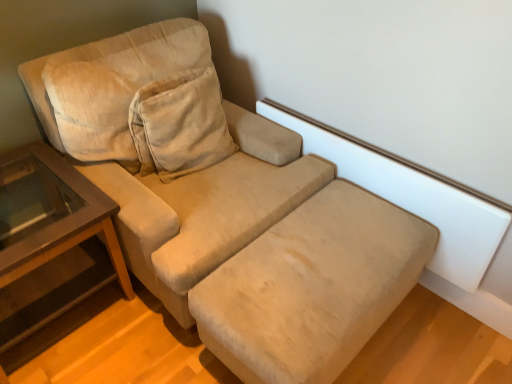
What do you see at coordinates (59, 222) in the screenshot? This screenshot has width=512, height=384. I see `brown wood table at left` at bounding box center [59, 222].

The image size is (512, 384). Find the location of `brown wood table at left`. brown wood table at left is located at coordinates (59, 222).

Measure the distance between point [76,238] and camera.

Point [76,238] and camera are 1.42 meters apart.

The height and width of the screenshot is (384, 512). Describe the element at coordinates (312, 287) in the screenshot. I see `beige fabric footrest at lower center` at that location.

Measure the distance between beige fabric footrest at lower center and camera.

They are 3.64 feet apart.

Where is `beige fabric footrest at lower center`? beige fabric footrest at lower center is located at coordinates (312, 287).

At what (x,y) coordinates should I click in order to perform the action: click on brown wood table at left. Please return your answer as a coordinate pair (x, y). This screenshot has height=384, width=512. Looking at the image, I should click on (59, 222).

Does beige fabric footrest at lower center appear on the left side of brown wood table at left?

Incorrect, beige fabric footrest at lower center is not on the left side of brown wood table at left.

Between beige fabric footrest at lower center and brown wood table at left, which one is positioned in front?

Positioned in front is beige fabric footrest at lower center.

Does point (412, 221) come farther from viewer compared to point (19, 275)?

Yes, it is.

From the image's perspective, which object appears higher, beige fabric footrest at lower center or brown wood table at left?

brown wood table at left is shown above in the image.

From a real-world perspective, is beige fabric footrest at lower center located higher than brown wood table at left?

No, from a real-world perspective, beige fabric footrest at lower center is not over brown wood table at left

Can you confirm if beige fabric footrest at lower center is wider than brown wood table at left?

No.

From their relative heights in the image, would you say beige fabric footrest at lower center is taller or shorter than brown wood table at left?

Considering their sizes, beige fabric footrest at lower center has less height than brown wood table at left.

Considering the sizes of beige fabric footrest at lower center and brown wood table at left in the image, is beige fabric footrest at lower center bigger or smaller than brown wood table at left?

beige fabric footrest at lower center is smaller than brown wood table at left.

Choose the correct answer: Is beige fabric footrest at lower center inside brown wood table at left or outside it?

beige fabric footrest at lower center is spatially situated outside brown wood table at left.

Is beige fabric footrest at lower center placed right next to brown wood table at left?

No, beige fabric footrest at lower center is not beside brown wood table at left.

Is beige fabric footrest at lower center oriented away from brown wood table at left?

Yes.

Can you tell me how much beige fabric footrest at lower center and brown wood table at left differ in facing direction?

The angular difference between beige fabric footrest at lower center and brown wood table at left is 1.96 degrees.

Find the location of a particular element. Image resolution: width=512 pixels, height=384 pixels. footrest on the right of brown wood table at left is located at coordinates (312, 287).

Is brown wood table at left at the left side of beige fabric footrest at lower center?

Indeed, brown wood table at left is positioned on the left side of beige fabric footrest at lower center.

Considering their positions, is brown wood table at left located in front of or behind beige fabric footrest at lower center?

brown wood table at left is positioned farther from the viewer than beige fabric footrest at lower center.

Which is closer, (93,218) or (303,344)?

Point (93,218).

From the image's perspective, which one is positioned higher, brown wood table at left or beige fabric footrest at lower center?

brown wood table at left.

From a real-world perspective, is brown wood table at left positioned above or below beige fabric footrest at lower center?

In terms of real-world spatial position, brown wood table at left is above beige fabric footrest at lower center.

Between brown wood table at left and beige fabric footrest at lower center, which one has smaller width?

beige fabric footrest at lower center is thinner.

Is brown wood table at left shorter than beige fabric footrest at lower center?

Incorrect, the height of brown wood table at left does not fall short of that of beige fabric footrest at lower center.

Considering the relative sizes of brown wood table at left and beige fabric footrest at lower center in the image provided, is brown wood table at left smaller than beige fabric footrest at lower center?

No.

Would you say brown wood table at left is inside or outside beige fabric footrest at lower center?

brown wood table at left is outside beige fabric footrest at lower center.

Can you see brown wood table at left touching beige fabric footrest at lower center?

brown wood table at left and beige fabric footrest at lower center are clearly separated.

Is brown wood table at left looking in the opposite direction of beige fabric footrest at lower center?

No.

Based on the photo, how many degrees apart are the facing directions of brown wood table at left and beige fabric footrest at lower center?

brown wood table at left and beige fabric footrest at lower center are facing 1.96 degrees away from each other.

Find the location of a particular element. This screenshot has height=384, width=512. footrest that appears on the right of brown wood table at left is located at coordinates (312, 287).

I want to click on the footrest located below the brown wood table at left (from the image's perspective), so click(x=312, y=287).

Where is `footrest that appears on the right of brown wood table at left`? The image size is (512, 384). footrest that appears on the right of brown wood table at left is located at coordinates (312, 287).